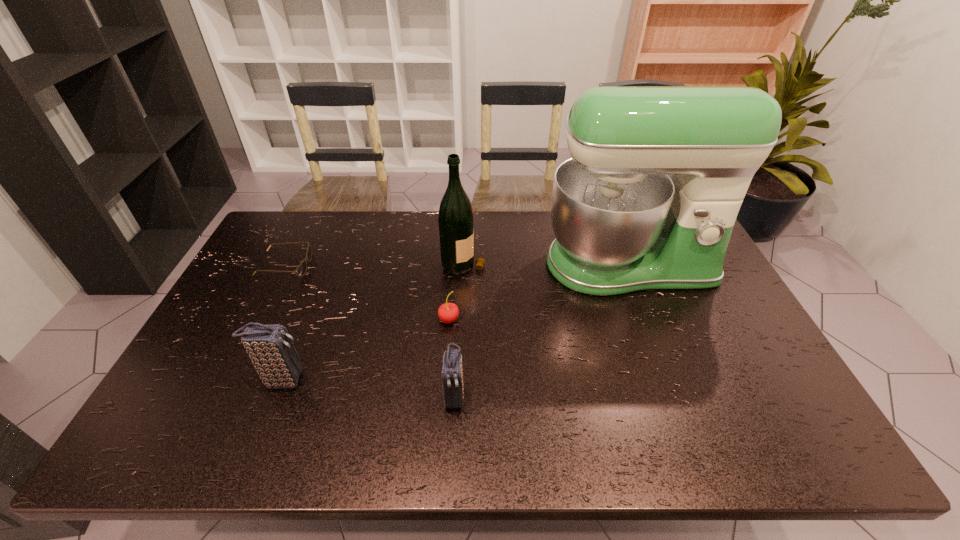
In the current image, all clutch bags are evenly spaced. To maintain this equal spacing, where should an additional clutch bag be placed on the right? Please point out a free spot. Please provide its 2D coordinates. Your answer should be formatted as a tuple, i.e. [(x, y)], where the tuple contains the x and y coordinates of a point satisfying the conditions above.

[(638, 415)]